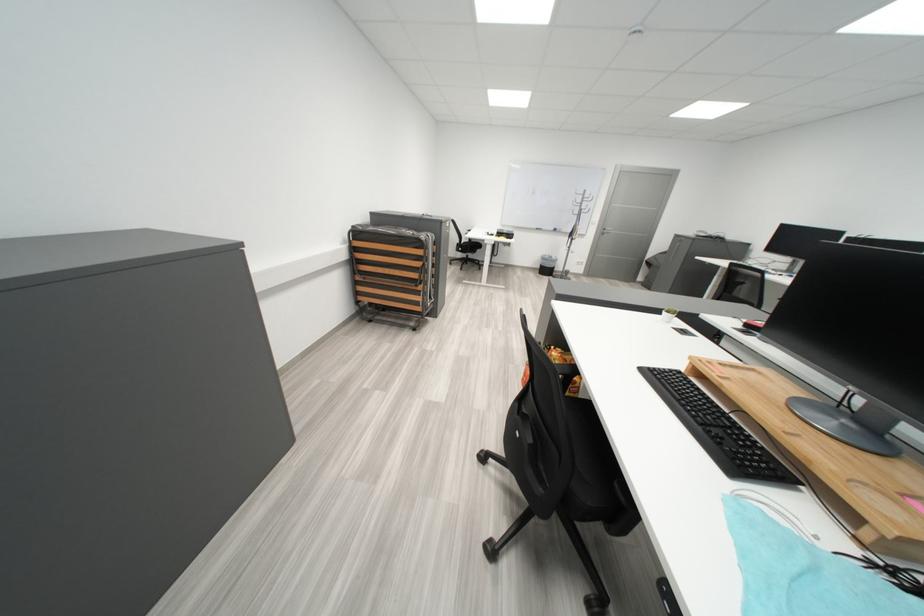
The image size is (924, 616). What do you see at coordinates (565, 368) in the screenshot? I see `a black chair armrest` at bounding box center [565, 368].